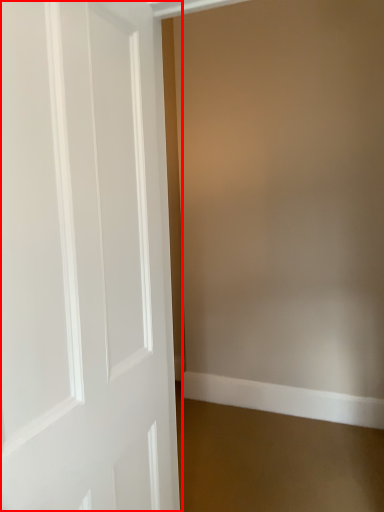
Question: From the image's perspective, where is door (annotated by the red box) located in relation to molding in the image?

Choices:
 (A) above
 (B) below

Answer: (A)